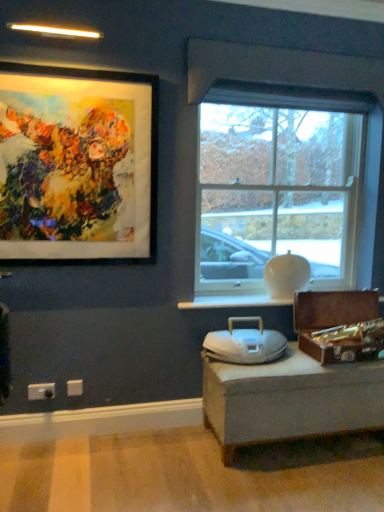
Locate an element on the screen. The image size is (384, 512). empty space that is ontop of matte black picture frame at upper left (from a real-world perspective) is located at coordinates (72, 77).